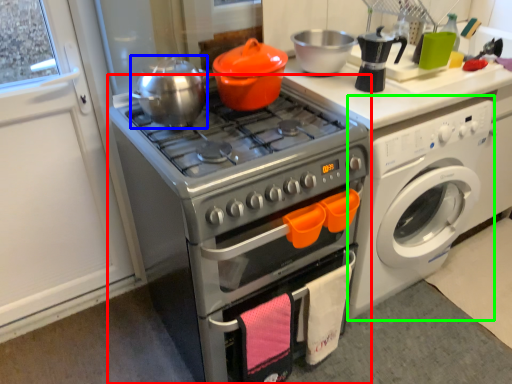
Question: Based on their relative distances, which object is farther from oven (highlighted by a red box)? Choose from tea pot (highlighted by a blue box) and washing machine (highlighted by a green box).

Choices:
 (A) tea pot
 (B) washing machine

Answer: (B)